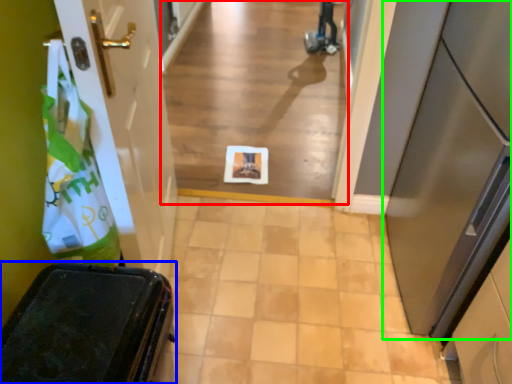
Question: Which object is positioned closest to alley (highlighted by a red box)? Select from furniture (highlighted by a blue box) and door (highlighted by a green box).

Choices:
 (A) furniture
 (B) door

Answer: (B)